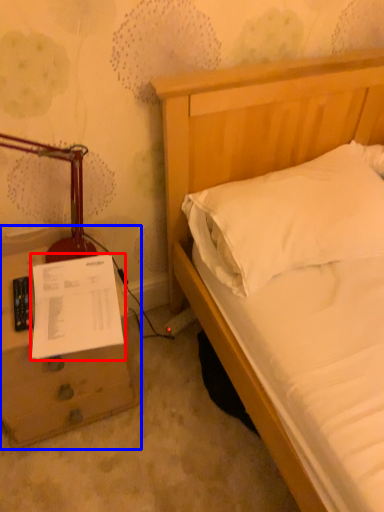
Question: Among these objects, which one is nearest to the camera, document (highlighted by a red box) or nightstand (highlighted by a blue box)?

Choices:
 (A) document
 (B) nightstand

Answer: (B)